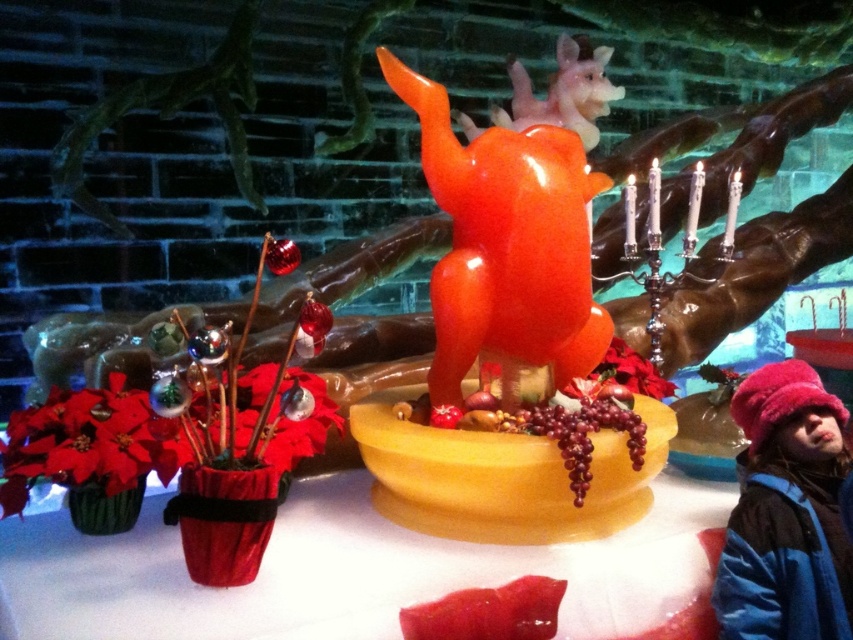
Question: Is shiny orange sculpture at center wider than matte green vase at lower left?

Choices:
 (A) yes
 (B) no

Answer: (A)

Question: Estimate the real-world distances between objects in this image. Which object is farther from the poinsettia matte at center?

Choices:
 (A) shiny orange sculpture at center
 (B) fuzzy pink hat at lower right
 (C) glossy plastic reindeer at upper center

Answer: (C)

Question: Which of the following is the closest to the observer?

Choices:
 (A) (126, 461)
 (B) (657, 374)
 (C) (825, 618)

Answer: (C)

Question: Which object appears closest to the camera in this image?

Choices:
 (A) glossy plastic reindeer at upper center
 (B) shiny orange sculpture at center

Answer: (B)

Question: Does translucent yellow bowl at center appear on the left side of poinsettia matte at center?

Choices:
 (A) yes
 (B) no

Answer: (A)

Question: From the image, what is the correct spatial relationship of shiny orange sculpture at center in relation to poinsettia matte at center?

Choices:
 (A) above
 (B) below

Answer: (A)